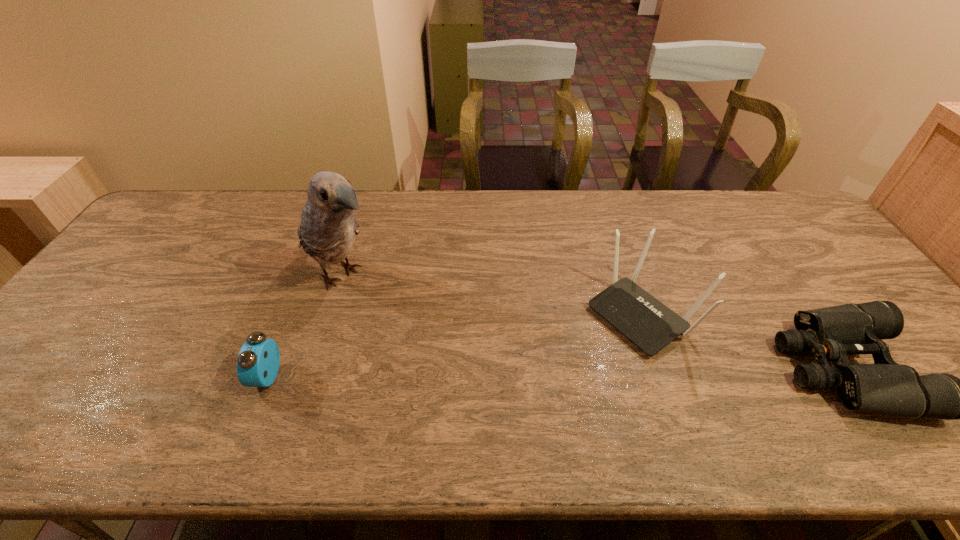
The width and height of the screenshot is (960, 540). Find the location of `alarm clock`. alarm clock is located at coordinates (258, 362).

The width and height of the screenshot is (960, 540). In order to click on binoculars in this screenshot , I will do `click(832, 333)`.

Image resolution: width=960 pixels, height=540 pixels. What are the coordinates of `the rightmost object` in the screenshot? It's located at (832, 333).

You are a GUI agent. You are given a task and a screenshot of the screen. Output one action in this format:
    pyautogui.click(x=<x>, y=<y>)
    Task: Click on the tallest object
    Image resolution: width=960 pixels, height=540 pixels.
    Given the screenshot: What is the action you would take?
    pyautogui.click(x=328, y=227)

The image size is (960, 540). In order to click on router in this screenshot , I will do `click(649, 324)`.

Image resolution: width=960 pixels, height=540 pixels. Identify the location of the third shortest object. (649, 324).

The height and width of the screenshot is (540, 960). I want to click on vacant space located 0.340m on the face of the second shortest object, so click(112, 376).

Where is `free location located 0.180m on the face of the second shortest object`? This screenshot has height=540, width=960. free location located 0.180m on the face of the second shortest object is located at coordinates (180, 376).

The width and height of the screenshot is (960, 540). I want to click on blank space located on the face of the second shortest object, so click(86, 376).

The width and height of the screenshot is (960, 540). In order to click on vacant space located 0.280m through the eyepieces of the shortest object in this screenshot , I will do `click(667, 368)`.